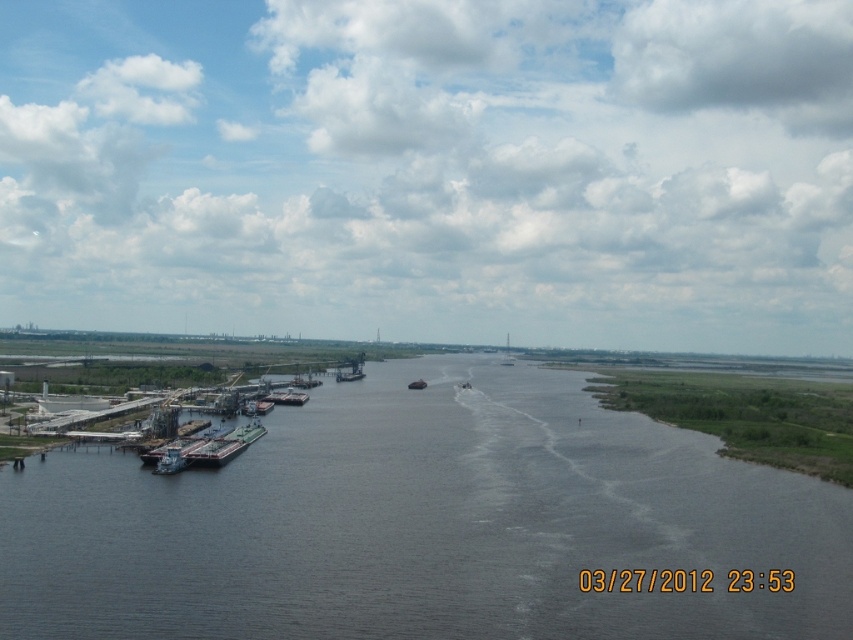
You are standing on the dock and want to walk to the small island on the right. There is a metallic gray barge at lower left and dark gray water at center. Which object should you avoid stepping on to reach the island safely?

You should avoid stepping on the metallic gray barge at lower left because the dark gray water at center is positioned to its right, meaning the barge is on the left side of the water path towards the island. Stepping on the barge could be unsafe as it is a large vessel, while the dark gray water at center is the natural path towards the island.

From the picture: You are standing on the dock and want to observe the dark gray water at center and the metallic gray barge at lower left. Which object is positioned lower in the image?

The dark gray water at center is located below the metallic gray barge at lower left, so the dark gray water at center is positioned lower in the image.

You are standing at the dock area on the left side of the river and want to take a photo of both point (552, 420) and point (158, 468) in the same frame. Which point should you focus on first to ensure both are in focus?

You should focus on point (552, 420) first because it is further away from you than point (158, 468), so focusing on the further point will ensure both are in focus.